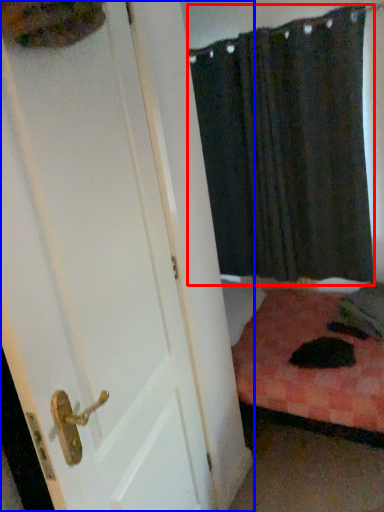
Question: Which of the following is the farthest to the observer, curtain (highlighted by a red box) or door (highlighted by a blue box)?

Choices:
 (A) curtain
 (B) door

Answer: (A)